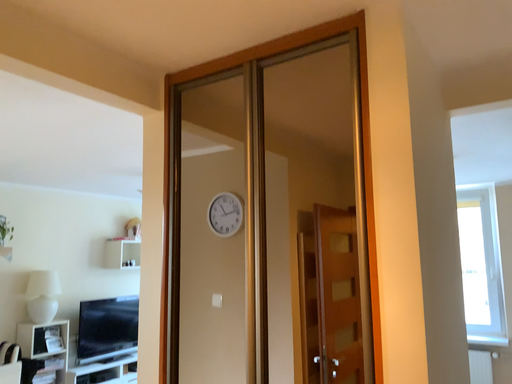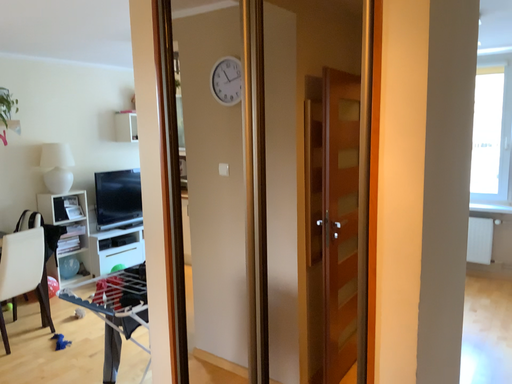
Question: How did the camera likely rotate when shooting the video?

Choices:
 (A) rotated upward
 (B) rotated downward

Answer: (B)